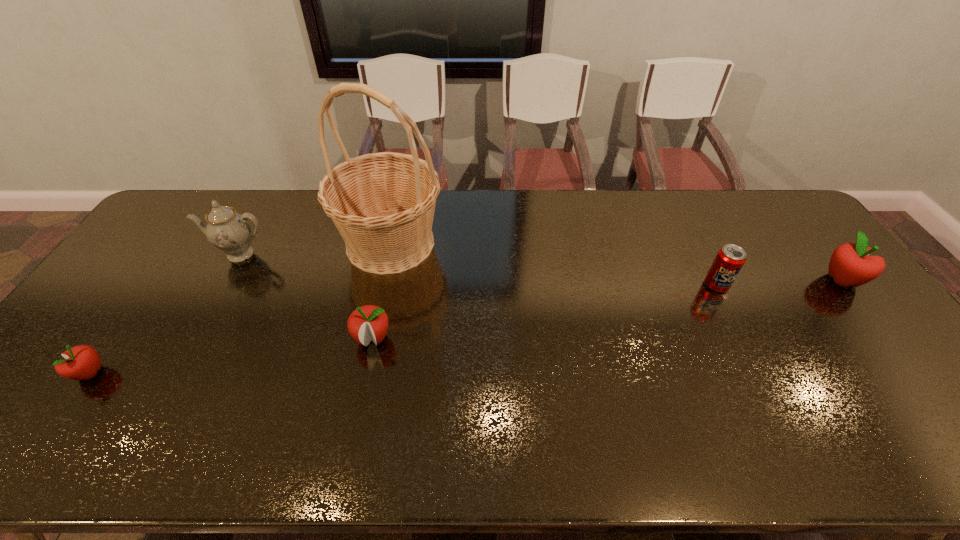
Where is `free space that satisfies the following two spatial constraints: 1. on the back side of the farthest apple; 2. on the left side of the nearest apple`? free space that satisfies the following two spatial constraints: 1. on the back side of the farthest apple; 2. on the left side of the nearest apple is located at coordinates (156, 280).

The height and width of the screenshot is (540, 960). In order to click on vacant space that satisfies the following two spatial constraints: 1. on the back side of the second object from right to left; 2. on the right side of the farthest apple in this screenshot , I will do `click(713, 280)`.